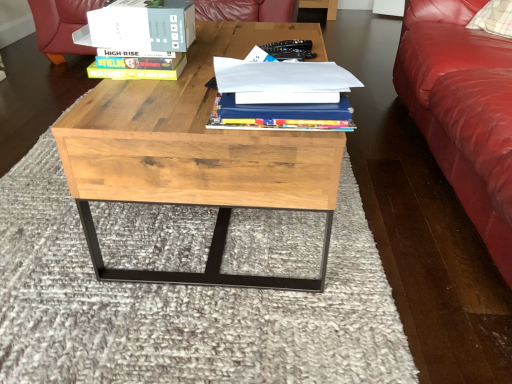
Question: From the image's perspective, is white cardboard box at upper center below hardcover book at upper left?

Choices:
 (A) no
 (B) yes

Answer: (A)

Question: Is white cardboard box at upper center closer to camera compared to hardcover book at upper left?

Choices:
 (A) yes
 (B) no

Answer: (A)

Question: Is white cardboard box at upper center not within hardcover book at upper left?

Choices:
 (A) yes
 (B) no

Answer: (A)

Question: Does white cardboard box at upper center have a smaller size compared to hardcover book at upper left?

Choices:
 (A) no
 (B) yes

Answer: (A)

Question: Considering the relative sizes of white cardboard box at upper center and hardcover book at upper left in the image provided, is white cardboard box at upper center taller than hardcover book at upper left?

Choices:
 (A) yes
 (B) no

Answer: (A)

Question: From the image's perspective, is blue hardcover book at center located above or below white cardboard box at upper center?

Choices:
 (A) below
 (B) above

Answer: (A)

Question: From a real-world perspective, is blue hardcover book at center positioned above or below white cardboard box at upper center?

Choices:
 (A) below
 (B) above

Answer: (A)

Question: Relative to white cardboard box at upper center, is blue hardcover book at center in front or behind?

Choices:
 (A) front
 (B) behind

Answer: (A)

Question: Looking at their shapes, would you say blue hardcover book at center is wider or thinner than white cardboard box at upper center?

Choices:
 (A) thin
 (B) wide

Answer: (B)

Question: Relative to white cardboard box at upper center, is hardcover book at upper left in front or behind?

Choices:
 (A) front
 (B) behind

Answer: (B)

Question: From a real-world perspective, relative to white cardboard box at upper center, is hardcover book at upper left vertically above or below?

Choices:
 (A) below
 (B) above

Answer: (A)

Question: Does point (159, 74) appear closer or farther from the camera than point (148, 39)?

Choices:
 (A) closer
 (B) farther

Answer: (B)

Question: Considering the positions of hardcover book at upper left and white cardboard box at upper center in the image, is hardcover book at upper left wider or thinner than white cardboard box at upper center?

Choices:
 (A) thin
 (B) wide

Answer: (A)

Question: Considering the positions of point (217, 264) and point (185, 29), is point (217, 264) closer or farther from the camera than point (185, 29)?

Choices:
 (A) farther
 (B) closer

Answer: (A)

Question: Is natural wood coffee table at center in front of or behind white cardboard box at upper center in the image?

Choices:
 (A) front
 (B) behind

Answer: (A)